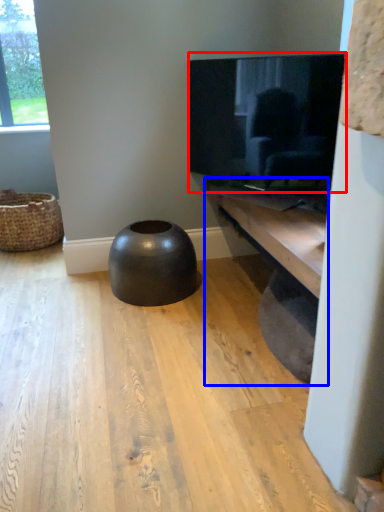
Question: Which of the following is the farthest to the observer, television (highlighted by a red box) or shelf (highlighted by a blue box)?

Choices:
 (A) television
 (B) shelf

Answer: (A)